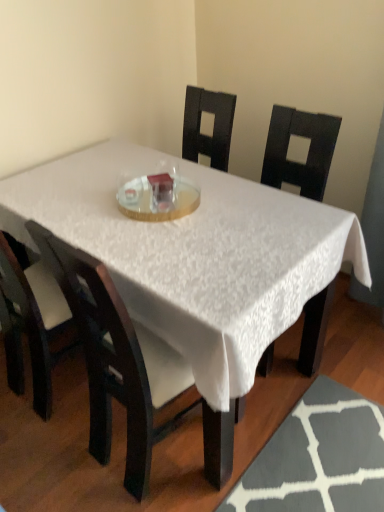
Image resolution: width=384 pixels, height=512 pixels. What are the coordinates of `free location to the right of clear glass plate at center` in the screenshot? It's located at (230, 203).